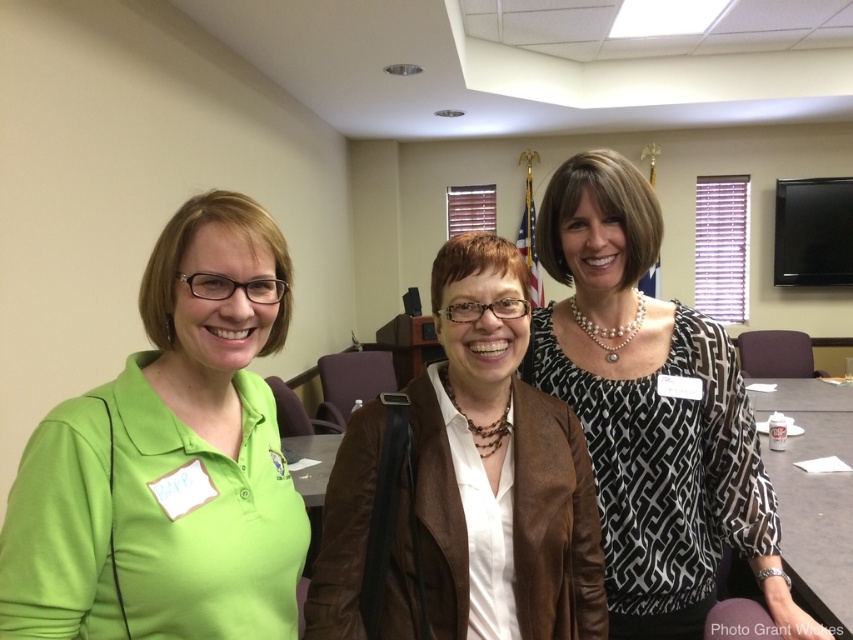
Question: Estimate the real-world distances between objects in this image. Which object is farther from the white paper at center?

Choices:
 (A) brown leather jacket at center
 (B) black and white patterned blouse at center
 (C) matte green polo shirt at left

Answer: (C)

Question: Which is farther from the brown leather jacket at center?

Choices:
 (A) matte green polo shirt at left
 (B) white paper at center
 (C) black and white patterned blouse at center

Answer: (B)

Question: Does black and white patterned blouse at center have a greater width compared to brown leather jacket at center?

Choices:
 (A) yes
 (B) no

Answer: (A)

Question: Does matte green polo shirt at left come in front of black and white patterned blouse at center?

Choices:
 (A) no
 (B) yes

Answer: (B)

Question: Does matte green polo shirt at left come in front of white paper at center?

Choices:
 (A) yes
 (B) no

Answer: (A)

Question: Which point is closer to the camera?

Choices:
 (A) black and white patterned blouse at center
 (B) matte green polo shirt at left
 (C) white paper at center

Answer: (B)